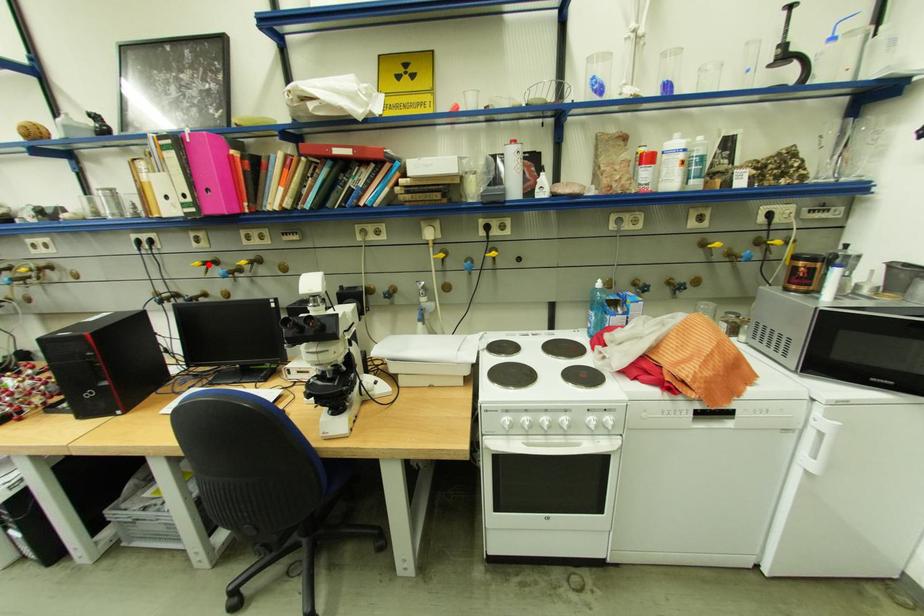
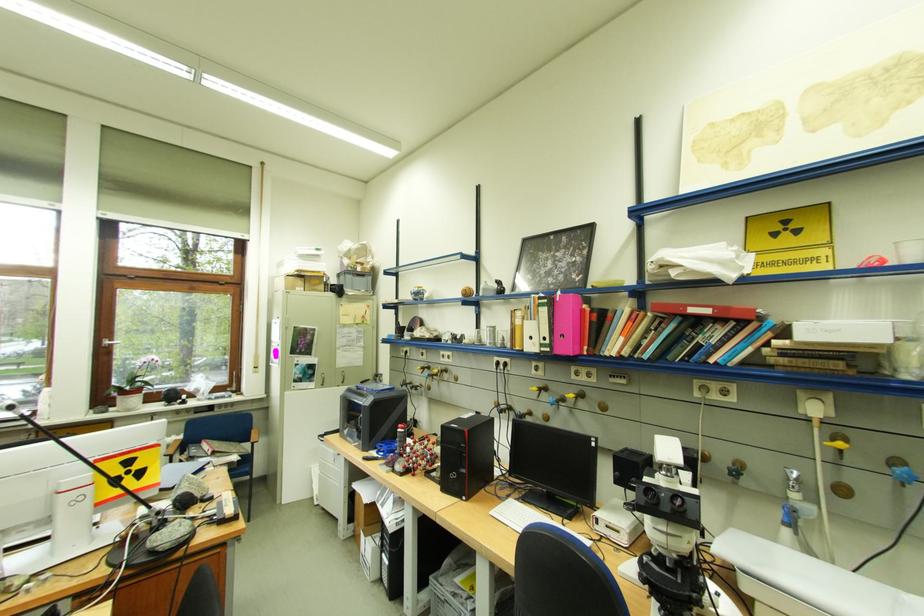
Find the pixel in the second image that matches the highlighted location in the first image.

(544, 390)